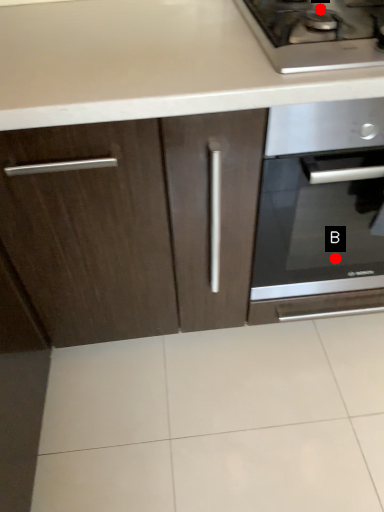
Question: Two points are circled on the image, labeled by A and B beside each circle. Which point appears farthest from the camera in this image?

Choices:
 (A) A is further
 (B) B is further

Answer: (B)